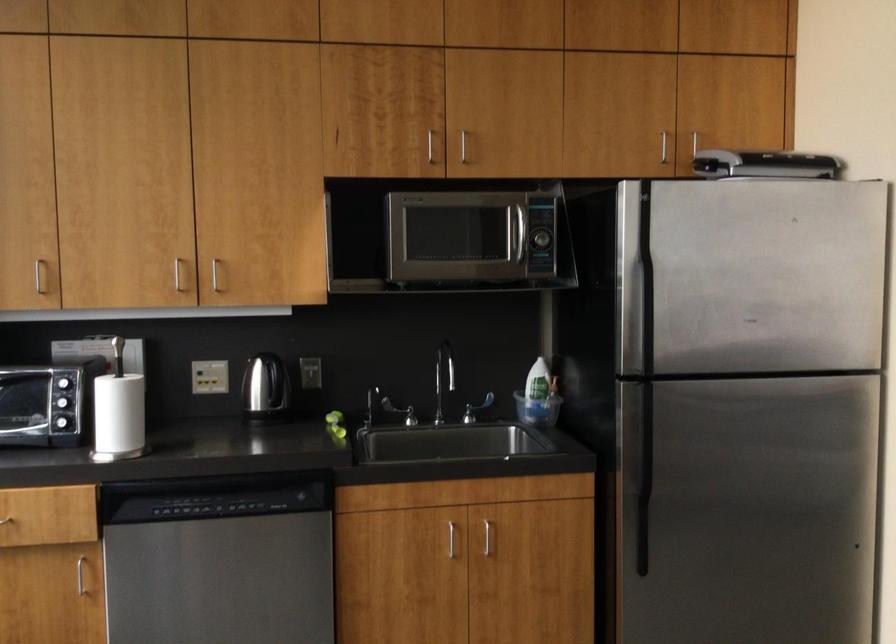
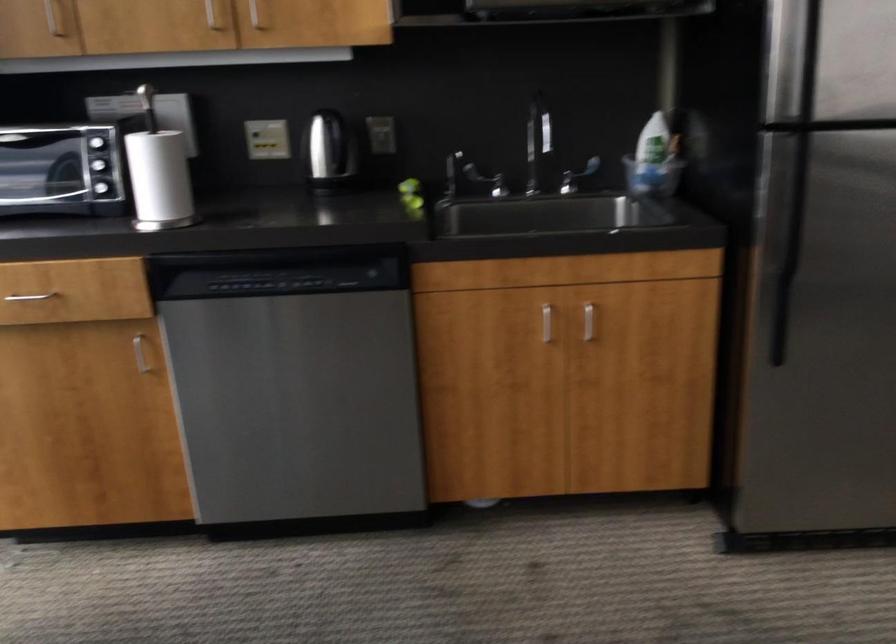
The point at (648,421) is marked in the first image. Where is the corresponding point in the second image?

(797, 181)